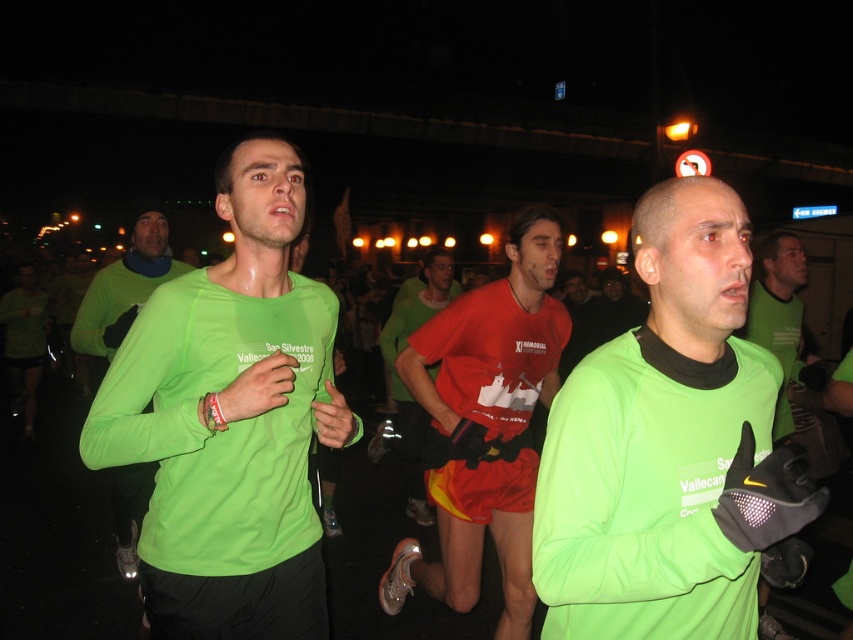
Does green matte long-sleeve shirt at center have a lesser width compared to matte green long-sleeve shirt at center?

Yes, green matte long-sleeve shirt at center is thinner than matte green long-sleeve shirt at center.

The height and width of the screenshot is (640, 853). I want to click on green matte long-sleeve shirt at center, so click(666, 445).

You are a GUI agent. You are given a task and a screenshot of the screen. Output one action in this format:
    pyautogui.click(x=<x>, y=<y>)
    Task: Click on the green matte long-sleeve shirt at center
    The height and width of the screenshot is (640, 853).
    Given the screenshot: What is the action you would take?
    pyautogui.click(x=666, y=445)

You are a GUI agent. You are given a task and a screenshot of the screen. Output one action in this format:
    pyautogui.click(x=<x>, y=<y>)
    Task: Click on the green matte long-sleeve shirt at center
    This screenshot has width=853, height=640.
    Given the screenshot: What is the action you would take?
    pyautogui.click(x=666, y=445)

Is neon green long-sleeve shirt at center taller than green matte long-sleeve shirt at left?

In fact, neon green long-sleeve shirt at center may be shorter than green matte long-sleeve shirt at left.

Is neon green long-sleeve shirt at center thinner than green matte long-sleeve shirt at left?

Yes, neon green long-sleeve shirt at center is thinner than green matte long-sleeve shirt at left.

Is point (131, 420) farther from viewer compared to point (32, 384)?

No, it is not.

Locate an element on the screen. neon green long-sleeve shirt at center is located at coordinates (231, 419).

The width and height of the screenshot is (853, 640). What do you see at coordinates (666, 445) in the screenshot? I see `green matte long-sleeve shirt at center` at bounding box center [666, 445].

Is green matte long-sleeve shirt at center smaller than neon green long-sleeve shirt at center?

Yes, green matte long-sleeve shirt at center is smaller than neon green long-sleeve shirt at center.

Based on the photo, measure the distance between point (622, 579) and camera.

1.09 meters

Where is `green matte long-sleeve shirt at center`? This screenshot has height=640, width=853. green matte long-sleeve shirt at center is located at coordinates (666, 445).